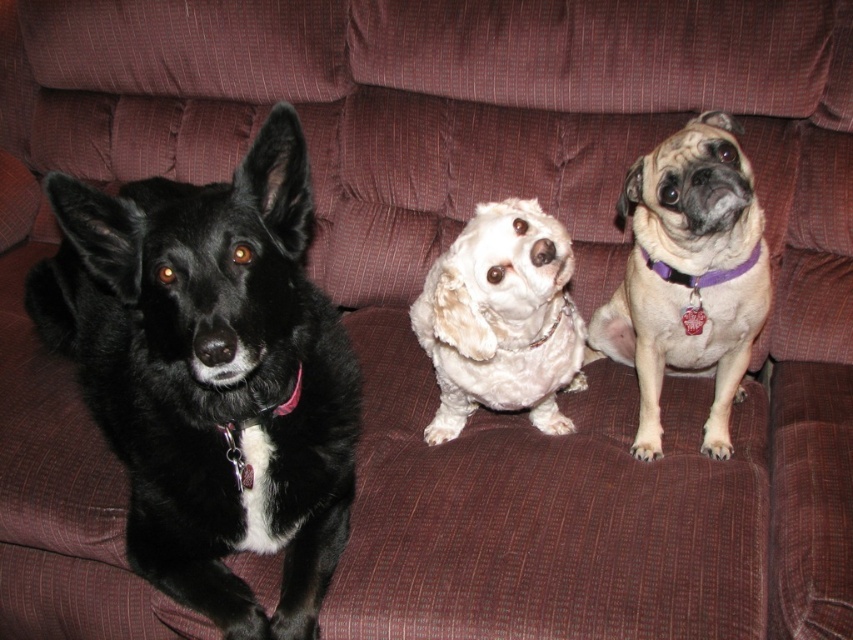
Question: Does black furry dog at left appear on the left side of white fluffy dog at center?

Choices:
 (A) yes
 (B) no

Answer: (A)

Question: Which point is farther from the camera taking this photo?

Choices:
 (A) (689, 248)
 (B) (315, 353)
 (C) (437, 424)

Answer: (C)

Question: Can you confirm if black furry dog at left is thinner than pale beige fur at center?

Choices:
 (A) no
 (B) yes

Answer: (A)

Question: Which object appears farthest from the camera in this image?

Choices:
 (A) black furry dog at left
 (B) pale beige fur at center
 (C) white fluffy dog at center

Answer: (C)

Question: Does black furry dog at left appear on the right side of pale beige fur at center?

Choices:
 (A) no
 (B) yes

Answer: (A)

Question: Which object is farther from the camera taking this photo?

Choices:
 (A) white fluffy dog at center
 (B) pale beige fur at center
 (C) black furry dog at left

Answer: (A)